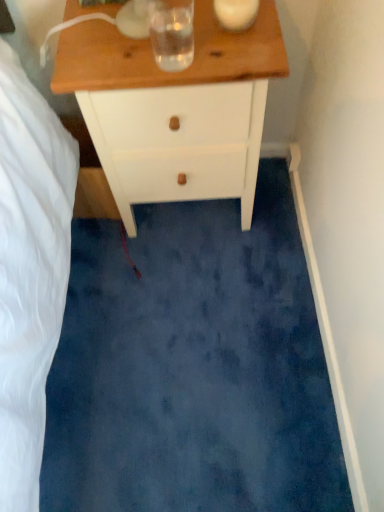
At what (x,y) coordinates should I click in order to perform the action: click on white wood chest of drawers at upper center. Please return your answer as a coordinate pair (x, y). The height and width of the screenshot is (512, 384). Looking at the image, I should click on (175, 108).

The height and width of the screenshot is (512, 384). Describe the element at coordinates (175, 108) in the screenshot. I see `white wood chest of drawers at upper center` at that location.

I want to click on clear glass water at upper center, so click(172, 33).

What do you see at coordinates (172, 33) in the screenshot? The height and width of the screenshot is (512, 384). I see `clear glass water at upper center` at bounding box center [172, 33].

You are a GUI agent. You are given a task and a screenshot of the screen. Output one action in this format:
    pyautogui.click(x=<x>, y=<y>)
    Task: Click on the white wood chest of drawers at upper center
    The width and height of the screenshot is (384, 512).
    Given the screenshot: What is the action you would take?
    pyautogui.click(x=175, y=108)

From the picture: Considering the relative positions of white wood chest of drawers at upper center and clear glass water at upper center in the image provided, is white wood chest of drawers at upper center to the right of clear glass water at upper center from the viewer's perspective?

Correct, you'll find white wood chest of drawers at upper center to the right of clear glass water at upper center.

In the image, is white wood chest of drawers at upper center positioned in front of or behind clear glass water at upper center?

In the image, white wood chest of drawers at upper center appears behind clear glass water at upper center.

Is point (206, 31) behind point (166, 0)?

No.

From the image's perspective, who appears lower, white wood chest of drawers at upper center or clear glass water at upper center?

From the image's view, white wood chest of drawers at upper center is below.

From a real-world perspective, which object stands above the other?

From a 3D spatial view, clear glass water at upper center is above.

Is white wood chest of drawers at upper center wider than clear glass water at upper center?

Yes.

Consider the image. Can you confirm if white wood chest of drawers at upper center is taller than clear glass water at upper center?

Indeed, white wood chest of drawers at upper center has a greater height compared to clear glass water at upper center.

Considering the sizes of objects white wood chest of drawers at upper center and clear glass water at upper center in the image provided, who is smaller, white wood chest of drawers at upper center or clear glass water at upper center?

Smaller between the two is clear glass water at upper center.

Is white wood chest of drawers at upper center situated inside clear glass water at upper center or outside?

white wood chest of drawers at upper center is located beyond the bounds of clear glass water at upper center.

In the scene shown: Does white wood chest of drawers at upper center touch clear glass water at upper center?

They are not placed beside each other.

From the picture: Could you tell me if white wood chest of drawers at upper center is turned towards clear glass water at upper center?

No, white wood chest of drawers at upper center is not turned towards clear glass water at upper center.

How different are the orientations of white wood chest of drawers at upper center and clear glass water at upper center in degrees?

They differ by 1.93 degrees in their facing directions.

Where is `chest of drawers below the clear glass water at upper center (from the image's perspective)`? chest of drawers below the clear glass water at upper center (from the image's perspective) is located at coordinates (175, 108).

Does clear glass water at upper center appear on the left side of white wood chest of drawers at upper center?

Yes.

Is clear glass water at upper center closer to the viewer compared to white wood chest of drawers at upper center?

Yes, clear glass water at upper center is in front of white wood chest of drawers at upper center.

Is point (173, 24) more distant than point (171, 99)?

No, it is not.

From the image's perspective, does clear glass water at upper center appear lower than white wood chest of drawers at upper center?

No, from the image's perspective, clear glass water at upper center is not beneath white wood chest of drawers at upper center.

From a real-world perspective, is clear glass water at upper center physically above white wood chest of drawers at upper center?

Yes, from a real-world perspective, clear glass water at upper center is over white wood chest of drawers at upper center

Considering the relative sizes of clear glass water at upper center and white wood chest of drawers at upper center in the image provided, is clear glass water at upper center wider than white wood chest of drawers at upper center?

No, clear glass water at upper center is not wider than white wood chest of drawers at upper center.

In terms of height, does clear glass water at upper center look taller or shorter compared to white wood chest of drawers at upper center?

Considering their sizes, clear glass water at upper center has less height than white wood chest of drawers at upper center.

Which of these two, clear glass water at upper center or white wood chest of drawers at upper center, is smaller?

Smaller between the two is clear glass water at upper center.

Would you say white wood chest of drawers at upper center is part of clear glass water at upper center's contents?

Definitely not — white wood chest of drawers at upper center is not inside clear glass water at upper center.

Does clear glass water at upper center touch white wood chest of drawers at upper center?

clear glass water at upper center and white wood chest of drawers at upper center are not in contact.

Is white wood chest of drawers at upper center at the back of clear glass water at upper center?

No.

How different are the orientations of clear glass water at upper center and white wood chest of drawers at upper center in degrees?

The angle between the facing direction of clear glass water at upper center and the facing direction of white wood chest of drawers at upper center is 1.93 degrees.

Measure the distance from clear glass water at upper center to white wood chest of drawers at upper center.

clear glass water at upper center and white wood chest of drawers at upper center are 8.02 inches apart.

This screenshot has width=384, height=512. I want to click on chest of drawers below the clear glass water at upper center (from the image's perspective), so pos(175,108).

Find the location of a particular element. The image size is (384, 512). the chest of drawers below the clear glass water at upper center (from a real-world perspective) is located at coordinates (175, 108).

Locate an element on the screen. This screenshot has height=512, width=384. beverage that appears above the white wood chest of drawers at upper center (from a real-world perspective) is located at coordinates (172, 33).